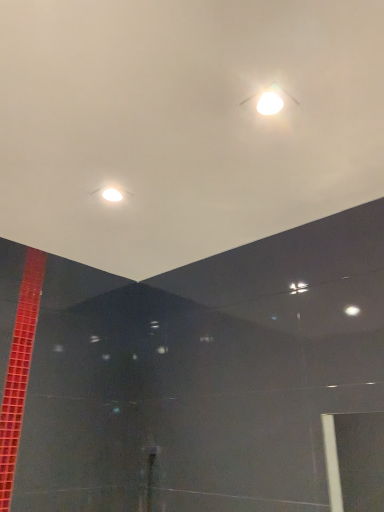
In order to face white glossy light at upper center, should I rotate leftwards or rightwards?

You should rotate right by 10.467 degrees.

What do you see at coordinates (270, 99) in the screenshot? The width and height of the screenshot is (384, 512). I see `white glossy light at upper center` at bounding box center [270, 99].

Locate an element on the screen. white glossy light at upper center is located at coordinates (270, 99).

Find the location of a particular element. This screenshot has width=384, height=512. white glossy light at upper center is located at coordinates (270, 99).